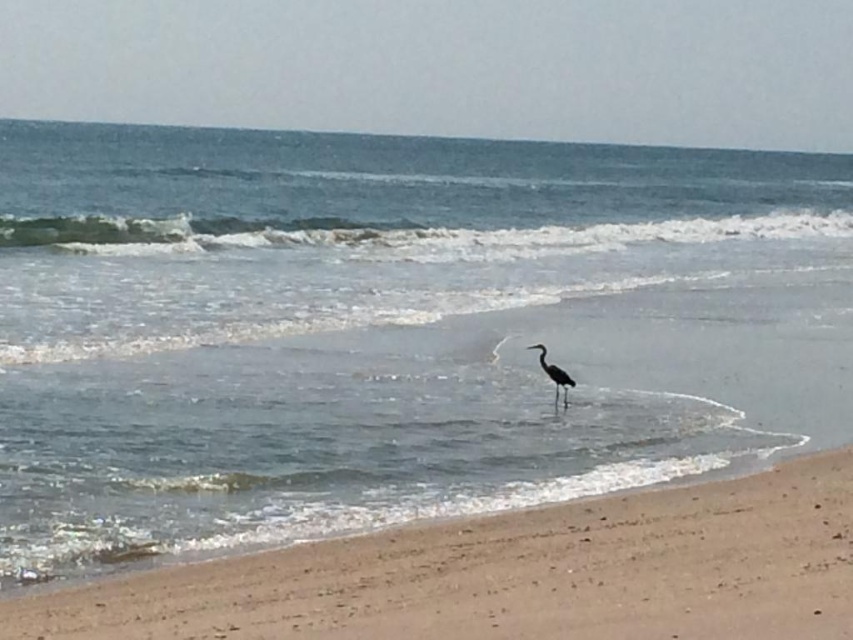
From the picture: You are standing at the shoreline and want to walk towards the two points marked on the beach. Which point, point [490,536] or point [543,369], would you reach first?

Point [490,536] is in front of point [543,369], so you would reach point [490,536] first.

You are a photographer trying to capture the gray matte heron at center on the sandy beach at lower right. Since you want to focus on the heron, should you choose a wide angle lens to emphasize the heron or a telephoto lens to highlight the beach?

The sandy beach at lower right is bigger than the gray matte heron at center, so using a wide angle lens would emphasize the heron by making it appear larger relative to the beach in the photo.

You are a photographer trying to capture the perfect shot of the solitary heron on the beach. To ensure the sandy beach at lower right is included in your composition, where should you position your camera relative to the heron?

The sandy beach at lower right is located at point (514, 573), so you should position your camera to the lower right of the heron to include the sandy beach at lower right in your composition.